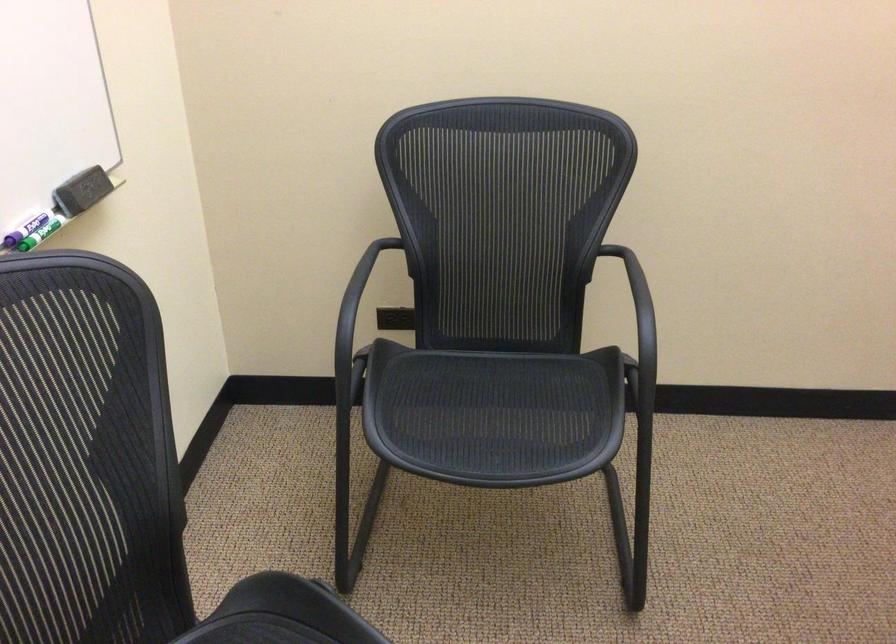
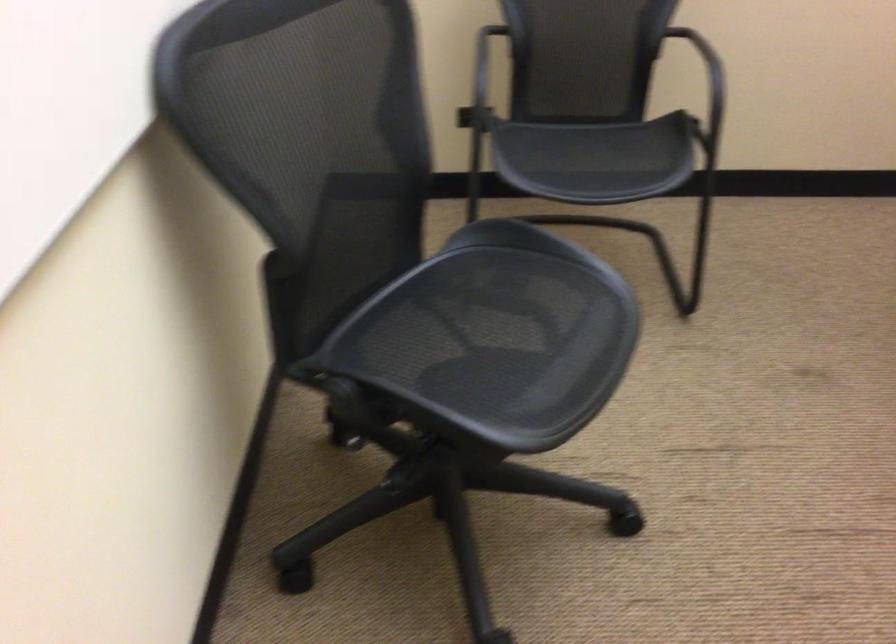
In a continuous first-person perspective shot, in which direction is the camera moving?

The movement direction of the cameraman is left, backward.